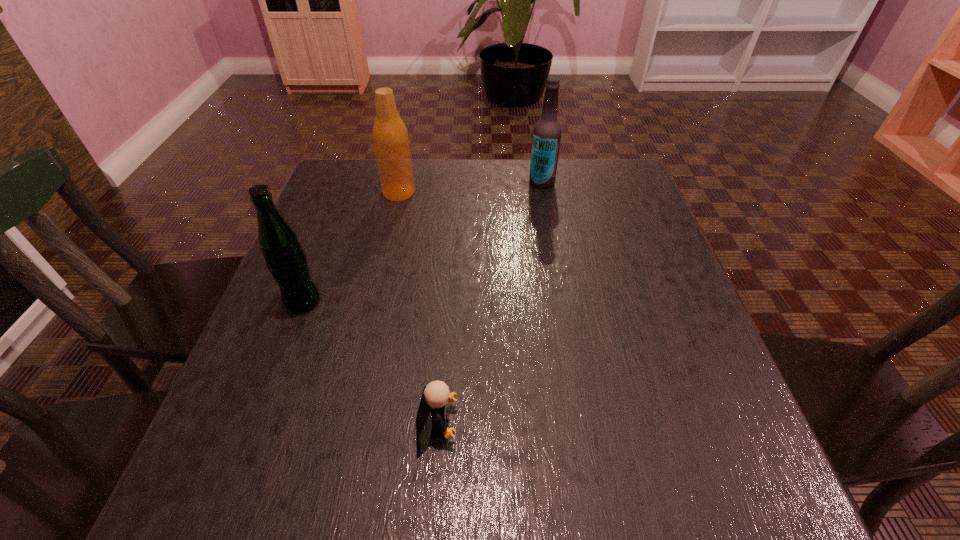
Find the location of a particular element. This screenshot has width=960, height=540. free location located on the front of the leftmost object is located at coordinates (268, 392).

You are a GUI agent. You are given a task and a screenshot of the screen. Output one action in this format:
    pyautogui.click(x=<x>, y=<y>)
    Task: Click on the free region located on the front-facing side of the shortest object
    Image resolution: width=960 pixels, height=540 pixels.
    Given the screenshot: What is the action you would take?
    pyautogui.click(x=552, y=424)

Identify the location of object that is at the near edge. The width and height of the screenshot is (960, 540). (435, 395).

This screenshot has height=540, width=960. What are the coordinates of `object that is at the left edge` in the screenshot? It's located at pyautogui.click(x=285, y=258).

Locate an element on the screen. vacant space at the far edge is located at coordinates (448, 167).

At what (x,y) coordinates should I click in order to perform the action: click on free region at the near edge. Please return your answer as a coordinate pair (x, y). The width and height of the screenshot is (960, 540). Looking at the image, I should click on (454, 482).

I want to click on vacant position at the left edge of the desktop, so click(x=300, y=363).

This screenshot has width=960, height=540. I want to click on vacant space at the right edge of the desktop, so click(710, 412).

You are a GUI agent. You are given a task and a screenshot of the screen. Output one action in this format:
    pyautogui.click(x=<x>, y=<y>)
    Task: Click on the vacant space at the far left corner of the desktop
    The width and height of the screenshot is (960, 540).
    Given the screenshot: What is the action you would take?
    pyautogui.click(x=350, y=169)

In the image, there is a desktop. Where is `vacant space at the far right corner`? vacant space at the far right corner is located at coordinates (607, 185).